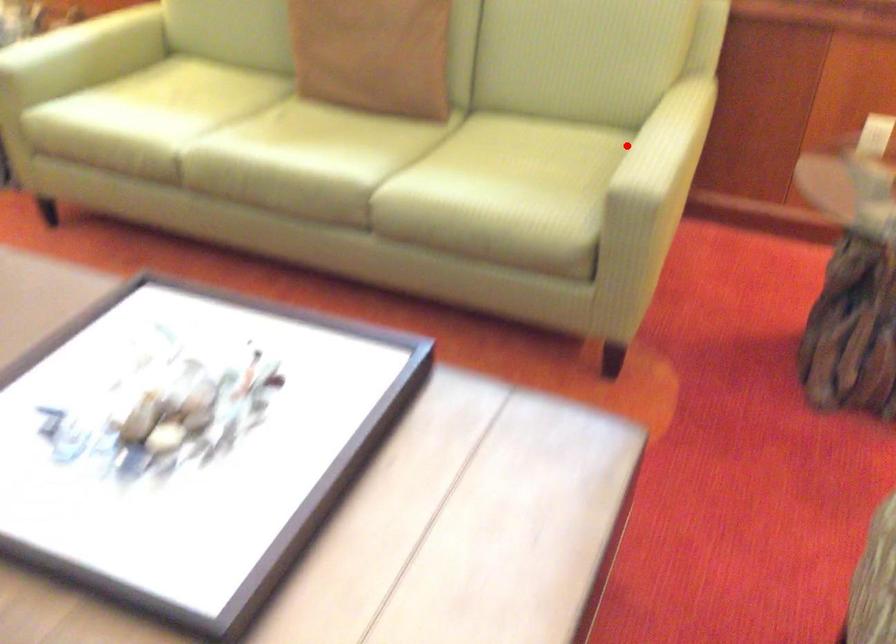
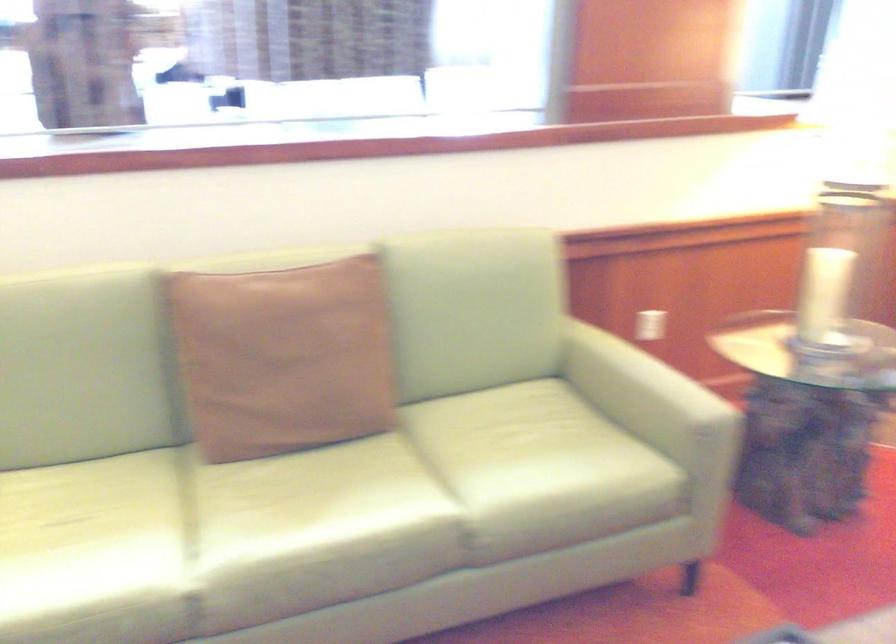
Question: I am providing you with two images of the same scene from different viewpoints. Image1 has a red point marked. In image2, the corresponding 3D location appears at what relative position? Reply with the corresponding letter.

Choices:
 (A) Closer
 (B) Farther

Answer: (B)